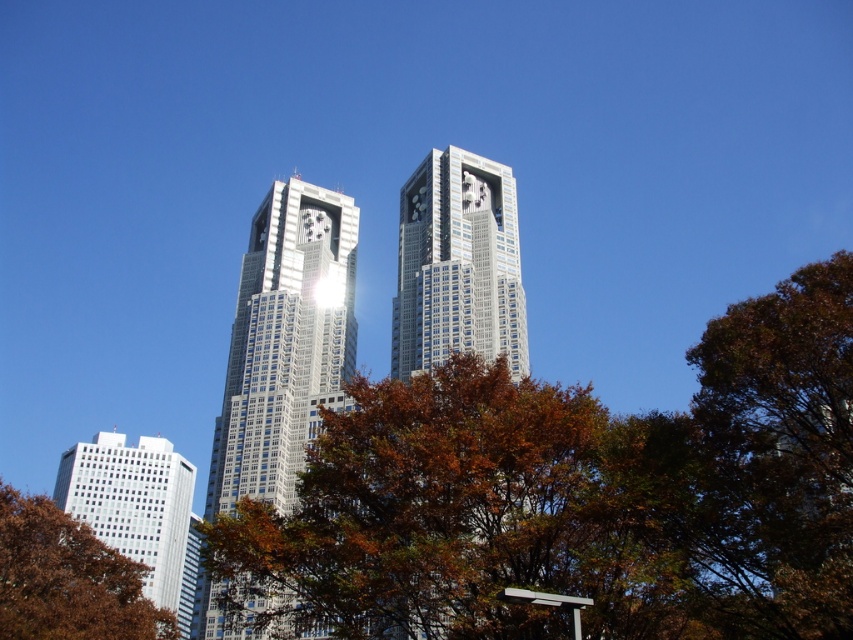
You are standing at the point marked by the coordinates point [579,497] in the image. Looking towards the two skyscrapers in the background, which direction should you face to see the angular skyscraper on the left?

Since the point [579,497] corresponds to the brown leafy tree at center, you should face towards the left to see the angular skyscraper on the left.

You are standing at the base of the reflective glass skyscraper at center. You want to take a photo of the entire building without any obstructions. Considering the distance from the camera to the skyscraper is 40.73 meters, what is the minimum focal length required for your camera lens to capture the entire building in one frame?

To capture the entire reflective glass skyscraper at center in one frame from a distance of 40.73 meters, the minimum focal length required depends on the camera sensor size and the building height. However, the given information specifies only the distance, so precise calculation requires additional data like sensor dimensions and building height.

You are an architect evaluating the urban space. You need to determine if the brown leafy tree at lower left can be moved closer to the reflective glass skyscraper at center without obstructing the view of the skyscraper. Considering their sizes, is this feasible?

The reflective glass skyscraper at center is larger in size than the brown leafy tree at lower left, so moving the brown leafy tree at lower left closer would not obstruct the view of the skyscraper as it is smaller in size.